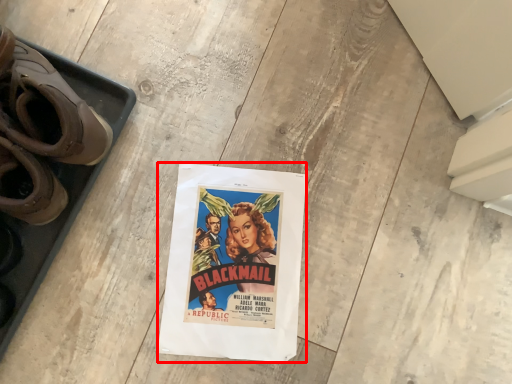
Question: In this image, where is poster (annotated by the red box) located relative to footwear?

Choices:
 (A) left
 (B) right

Answer: (B)